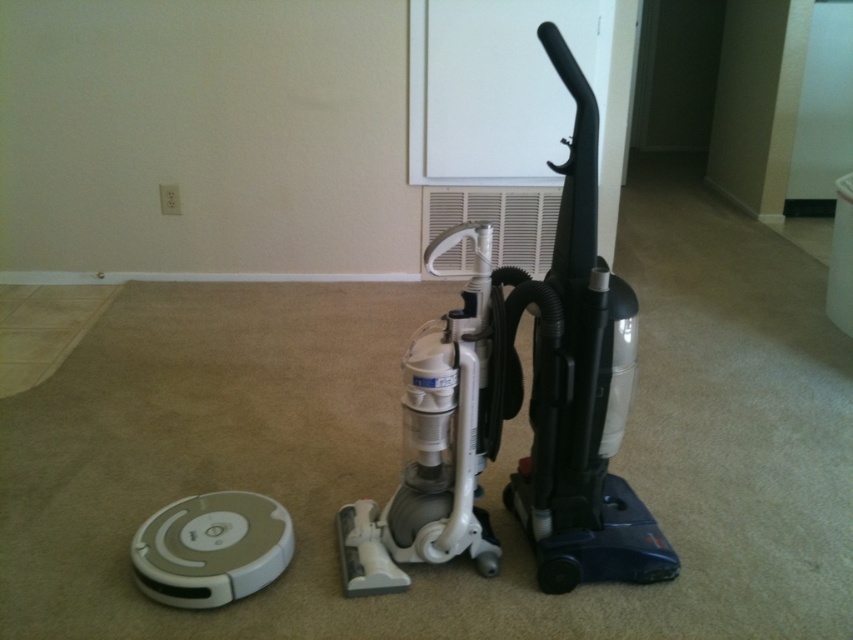
You are standing at the center of the room and want to move towards the white plastic robot vacuum cleaner at lower left. Which direction should you move to reach it?

You should move to the left from the center of the room to reach the white plastic robot vacuum cleaner at lower left since it is positioned at the lower left area of the image.